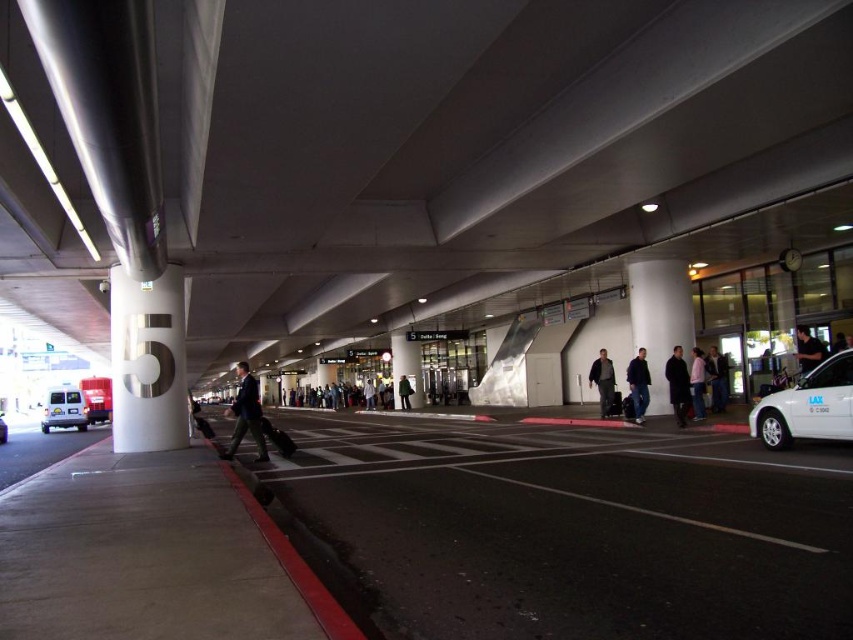
Question: Is dark blue suit at center in front of black leather jacket at center?

Choices:
 (A) yes
 (B) no

Answer: (A)

Question: Among these points, which one is farthest from the camera?

Choices:
 (A) (251, 420)
 (B) (650, 266)
 (C) (73, 410)

Answer: (C)

Question: Which point is closer to the camera taking this photo?

Choices:
 (A) (346, 403)
 (B) (630, 378)
 (C) (4, 429)
 (D) (701, 362)

Answer: (D)

Question: Is white glossy taxi at right above dark blue jacket at center?

Choices:
 (A) no
 (B) yes

Answer: (B)

Question: Which of the following is the closest to the observer?

Choices:
 (A) (717, 392)
 (B) (0, 428)

Answer: (A)

Question: Is gray concrete pavement at lower left wider than dark gray pants at center?

Choices:
 (A) no
 (B) yes

Answer: (B)